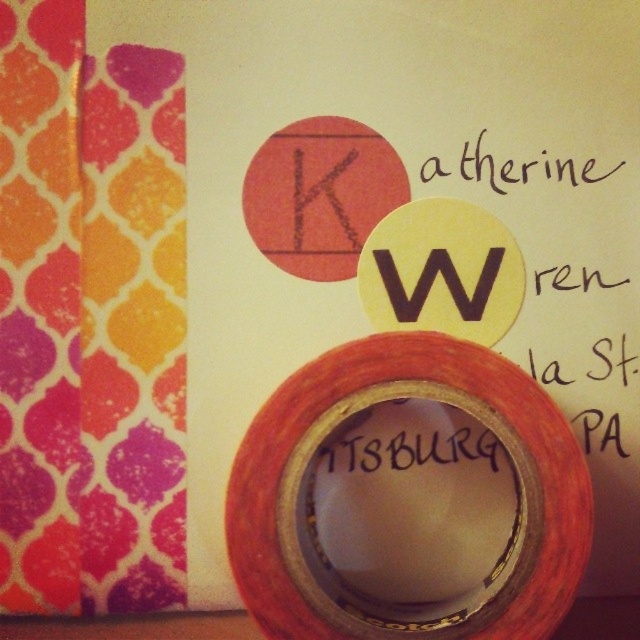
Who is positioned more to the right, matte orange tape at center or black paper at upper center?

black paper at upper center

This screenshot has width=640, height=640. What do you see at coordinates (408, 499) in the screenshot?
I see `matte orange tape at center` at bounding box center [408, 499].

Locate an element on the screen. This screenshot has height=640, width=640. matte orange tape at center is located at coordinates (408, 499).